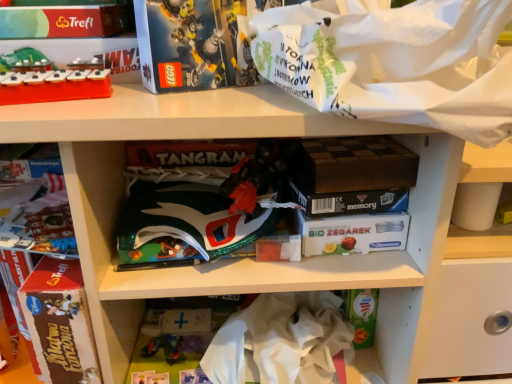
Question: From the image's perspective, is white paper bag at upper right positioned above or below brown cardboard book at left?

Choices:
 (A) below
 (B) above

Answer: (B)

Question: Based on their positions, is white paper bag at upper right located to the left or right of brown cardboard book at left?

Choices:
 (A) right
 (B) left

Answer: (A)

Question: Estimate the real-world distances between objects in this image. Which object is closer to the brown cardboard book at left?

Choices:
 (A) white paper bag at upper right
 (B) matte plastic xylophone at upper left
 (C) shiny green plastic book at center
 (D) white crumpled paper at center

Answer: (C)

Question: Estimate the real-world distances between objects in this image. Which object is closer to the white crumpled paper at center?

Choices:
 (A) shiny green plastic book at center
 (B) matte plastic xylophone at upper left
 (C) white paper bag at upper right
 (D) brown cardboard book at left

Answer: (A)